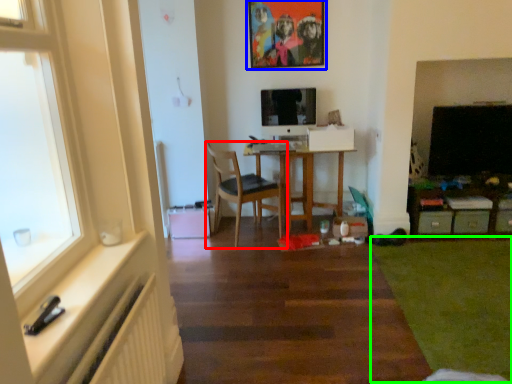
Question: Based on their relative distances, which object is farther from chair (highlighted by a red box)? Choose from picture frame (highlighted by a blue box) and plain (highlighted by a green box).

Choices:
 (A) picture frame
 (B) plain

Answer: (B)